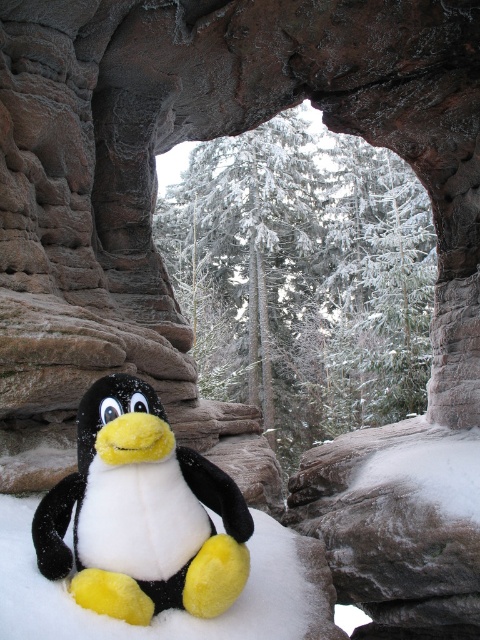
You are a GUI agent. You are given a task and a screenshot of the screen. Output one action in this format:
    pyautogui.click(x=<x>, y=<y>)
    Task: Click on the black plush penguin at center
    
    Given the screenshot: What is the action you would take?
    pyautogui.click(x=143, y=513)

Does black plush penguin at center appear over white fluffy snow at center?

Indeed, black plush penguin at center is positioned over white fluffy snow at center.

The width and height of the screenshot is (480, 640). What do you see at coordinates (143, 513) in the screenshot?
I see `black plush penguin at center` at bounding box center [143, 513].

Identify the location of black plush penguin at center. [143, 513].